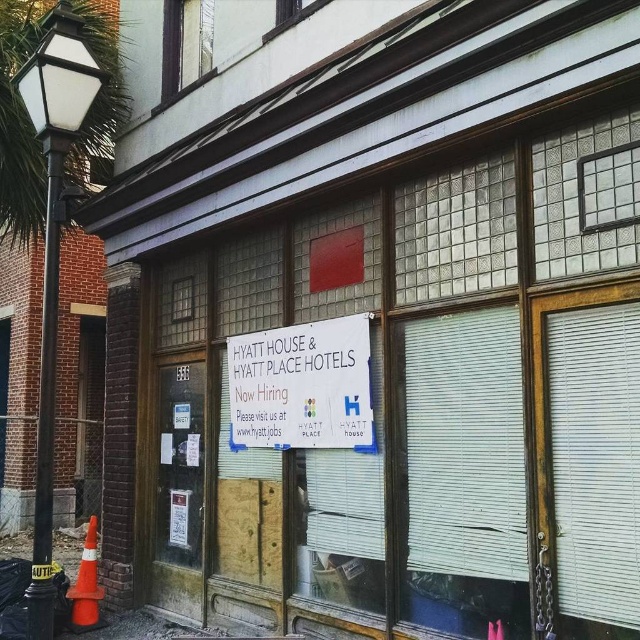
Question: Considering the relative positions of white paper sign at center and clear glass window at upper left in the image provided, where is white paper sign at center located with respect to clear glass window at upper left?

Choices:
 (A) left
 (B) right

Answer: (B)

Question: Does white paper sign at center appear under clear glass window at upper left?

Choices:
 (A) no
 (B) yes

Answer: (B)

Question: Can you confirm if clear glass window at upper left is bigger than clear glass window at upper center?

Choices:
 (A) no
 (B) yes

Answer: (B)

Question: Which object is closer to the camera taking this photo?

Choices:
 (A) clear glass window at upper left
 (B) clear glass window at upper center
 (C) white paper sign at center

Answer: (C)

Question: Among these objects, which one is nearest to the camera?

Choices:
 (A) white paper sign at center
 (B) clear glass window at upper left
 (C) clear glass window at upper center

Answer: (A)

Question: Which is farther from the white paper sign at center?

Choices:
 (A) clear glass window at upper left
 (B) clear glass window at upper center

Answer: (A)